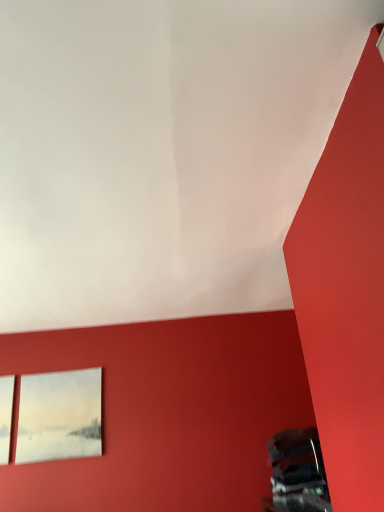
The height and width of the screenshot is (512, 384). Describe the element at coordinates (60, 415) in the screenshot. I see `matte white canvas at lower left` at that location.

Measure the distance between point (x=77, y=436) and camera.

Point (x=77, y=436) is 2.86 meters from camera.

I want to click on matte white canvas at lower left, so click(x=60, y=415).

This screenshot has height=512, width=384. Identify the location of matte white canvas at lower left. (60, 415).